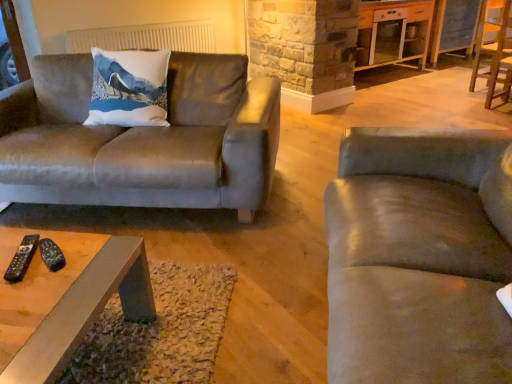
The width and height of the screenshot is (512, 384). Describe the element at coordinates (51, 255) in the screenshot. I see `black plastic remote at lower left, which is the first remote from right to left` at that location.

I want to click on suede couch at left, which appears as the 1th studio couch when viewed from the left, so click(142, 139).

What do you see at coordinates (142, 139) in the screenshot? I see `suede couch at left, which appears as the 2th studio couch when viewed from the right` at bounding box center [142, 139].

Locate an element on the screen. This screenshot has width=512, height=384. white fabric radiator at upper center is located at coordinates (147, 37).

What is the approximate width of white fabric radiator at upper center?

The width of white fabric radiator at upper center is 12.41 centimeters.

Image resolution: width=512 pixels, height=384 pixels. Describe the element at coordinates (494, 39) in the screenshot. I see `wooden chair at right` at that location.

Consider the image. Measure the distance between metallic gray coffee table at center and camera.

metallic gray coffee table at center is 29.10 inches away from camera.

Describe the element at coordinates (420, 257) in the screenshot. This screenshot has height=384, width=512. I see `suede-like gray couch at right, placed as the 2th studio couch when sorted from back to front` at that location.

What is the approximate height of white glossy cabinet at upper right?

white glossy cabinet at upper right is 37.19 inches in height.

I want to click on black plastic remote at lower left, positioned as the second remote in right-to-left order, so click(22, 258).

Image resolution: width=512 pixels, height=384 pixels. What do you see at coordinates (22, 258) in the screenshot?
I see `black plastic remote at lower left, the first remote when ordered from left to right` at bounding box center [22, 258].

I want to click on black plastic remote at lower left, which is the first remote from right to left, so [x=51, y=255].

From a real-world perspective, which object stands above the other?

In real-world perspective, black plastic remote at lower left, which is the first remote from right to left, is above.

Based on the photo, is the depth of black plastic remote at lower left, placed as the second remote when sorted from left to right, less than that of black plastic remote at lower left, the first remote when ordered from left to right?

No.

Who is bigger, black plastic remote at lower left, which is the first remote from right to left, or black plastic remote at lower left, the first remote when ordered from left to right?

With larger size is black plastic remote at lower left, which is the first remote from right to left.

Is black plastic remote at lower left, which is the first remote from right to left, to the left or to the right of black plastic remote at lower left, positioned as the second remote in right-to-left order, in the image?

Based on their positions, black plastic remote at lower left, which is the first remote from right to left, is located to the right of black plastic remote at lower left, positioned as the second remote in right-to-left order.

Would you say metallic gray coffee table at center is outside white fabric radiator at upper center?

Indeed, metallic gray coffee table at center is completely outside white fabric radiator at upper center.

Who is shorter, metallic gray coffee table at center or white fabric radiator at upper center?

metallic gray coffee table at center.

From the image's perspective, is metallic gray coffee table at center above or below white fabric radiator at upper center?

Clearly, from the image's perspective, metallic gray coffee table at center is below white fabric radiator at upper center.

Locate an element on the screen. entertainment center that appears on the right of suede couch at left, which appears as the 1th studio couch when viewed from the left is located at coordinates click(394, 33).

Can you confirm if white glossy cabinet at upper right is positioned to the right of suede couch at left, the 1th studio couch viewed from the back?

Yes.

Considering the positions of objects white glossy cabinet at upper right and suede couch at left, which appears as the 2th studio couch when viewed from the right, in the image provided, who is in front, white glossy cabinet at upper right or suede couch at left, which appears as the 2th studio couch when viewed from the right,?

suede couch at left, which appears as the 2th studio couch when viewed from the right.

Choose the correct answer: Is white glossy cabinet at upper right inside suede couch at left, which appears as the 2th studio couch when viewed from the right, or outside it?

white glossy cabinet at upper right exists outside the volume of suede couch at left, which appears as the 2th studio couch when viewed from the right.

In the scene shown: Considering the relative positions of metallic gray coffee table at center and black plastic remote at lower left, positioned as the second remote in right-to-left order, in the image provided, is metallic gray coffee table at center to the left of black plastic remote at lower left, positioned as the second remote in right-to-left order, from the viewer's perspective?

In fact, metallic gray coffee table at center is to the right of black plastic remote at lower left, positioned as the second remote in right-to-left order.

Considering the positions of points (49, 349) and (34, 236), is point (49, 349) closer to camera compared to point (34, 236)?

Yes, point (49, 349) is in front of point (34, 236).

From the picture: Are metallic gray coffee table at center and black plastic remote at lower left, the first remote when ordered from left to right, beside each other?

metallic gray coffee table at center is not next to black plastic remote at lower left, the first remote when ordered from left to right, and they're not touching.

Looking at this image, is metallic gray coffee table at center taller or shorter than black plastic remote at lower left, positioned as the second remote in right-to-left order?

metallic gray coffee table at center is taller than black plastic remote at lower left, positioned as the second remote in right-to-left order.

Is suede couch at left, the 1th studio couch viewed from the back, to the left or to the right of black plastic remote at lower left, which is the first remote from right to left, in the image?

In the image, suede couch at left, the 1th studio couch viewed from the back, appears on the left side of black plastic remote at lower left, which is the first remote from right to left.

Is suede couch at left, the 1th studio couch viewed from the back, positioned with its back to black plastic remote at lower left, which is the first remote from right to left?

No, suede couch at left, the 1th studio couch viewed from the back,'s orientation is not away from black plastic remote at lower left, which is the first remote from right to left.

From the image's perspective, which object appears higher, suede couch at left, the 1th studio couch viewed from the back, or black plastic remote at lower left, which is the first remote from right to left?

suede couch at left, the 1th studio couch viewed from the back.

Which is in front, suede couch at left, which appears as the 2th studio couch when viewed from the right, or black plastic remote at lower left, placed as the second remote when sorted from left to right?

black plastic remote at lower left, placed as the second remote when sorted from left to right.

Is there a large distance between white fabric radiator at upper center and wooden chair at right?

white fabric radiator at upper center is far away from wooden chair at right.

From the image's perspective, would you say white fabric radiator at upper center is shown under wooden chair at right?

Yes, from the image's perspective, white fabric radiator at upper center is beneath wooden chair at right.

Does white fabric radiator at upper center turn towards wooden chair at right?

No, white fabric radiator at upper center does not turn towards wooden chair at right.

Is white fabric radiator at upper center wider or thinner than wooden chair at right?

white fabric radiator at upper center is thinner than wooden chair at right.

Looking at this image, is wooden chair at right in contact with black plastic remote at lower left, positioned as the second remote in right-to-left order?

They are not placed beside each other.

Considering the relative sizes of wooden chair at right and black plastic remote at lower left, the first remote when ordered from left to right, in the image provided, is wooden chair at right shorter than black plastic remote at lower left, the first remote when ordered from left to right,?

Incorrect, the height of wooden chair at right does not fall short of that of black plastic remote at lower left, the first remote when ordered from left to right.

How far apart are wooden chair at right and black plastic remote at lower left, positioned as the second remote in right-to-left order?

The distance of wooden chair at right from black plastic remote at lower left, positioned as the second remote in right-to-left order, is 4.31 meters.

Would you say wooden chair at right is outside black plastic remote at lower left, the first remote when ordered from left to right?

Absolutely, wooden chair at right is external to black plastic remote at lower left, the first remote when ordered from left to right.

Identify the location of remote above the black plastic remote at lower left, positioned as the second remote in right-to-left order (from the image's perspective). (51, 255).

I want to click on coffee table located below the white fabric radiator at upper center (from the image's perspective), so click(x=66, y=299).

Looking at the image, which one is located closer to black plastic remote at lower left, the first remote when ordered from left to right, metallic gray coffee table at center or black plastic remote at lower left, which is the first remote from right to left?

black plastic remote at lower left, which is the first remote from right to left, is positioned closer to the anchor black plastic remote at lower left, the first remote when ordered from left to right.

Looking at this image, when comparing their distances from white glossy cabinet at upper right, does suede couch at left, which appears as the 2th studio couch when viewed from the right, or white fabric radiator at upper center seem further?

suede couch at left, which appears as the 2th studio couch when viewed from the right, lies further to white glossy cabinet at upper right than the other object.

When comparing their distances from metallic gray coffee table at center, does suede-like gray couch at right, which appears as the 1th studio couch when viewed from the front, or white fabric radiator at upper center seem closer?

suede-like gray couch at right, which appears as the 1th studio couch when viewed from the front, lies closer to metallic gray coffee table at center than the other object.

When comparing their distances from suede-like gray couch at right, placed as the 2th studio couch when sorted from back to front, does suede couch at left, which appears as the 1th studio couch when viewed from the left, or wooden chair at right seem closer?

The object closer to suede-like gray couch at right, placed as the 2th studio couch when sorted from back to front, is suede couch at left, which appears as the 1th studio couch when viewed from the left.

From the image, which object appears to be nearer to white glossy cabinet at upper right, black plastic remote at lower left, placed as the second remote when sorted from left to right, or wooden chair at right?

The object closer to white glossy cabinet at upper right is wooden chair at right.

Based on their spatial positions, is white glossy cabinet at upper right or metallic gray coffee table at center closer to suede-like gray couch at right, placed as the 2th studio couch when sorted from back to front?

metallic gray coffee table at center is positioned closer to the anchor suede-like gray couch at right, placed as the 2th studio couch when sorted from back to front.

Considering their positions, is suede couch at left, which appears as the 1th studio couch when viewed from the left, positioned closer to black plastic remote at lower left, the first remote when ordered from left to right, than black plastic remote at lower left, placed as the second remote when sorted from left to right?

black plastic remote at lower left, placed as the second remote when sorted from left to right.

From the image, which object appears to be nearer to white glossy cabinet at upper right, white fabric radiator at upper center or black plastic remote at lower left, placed as the second remote when sorted from left to right?

white fabric radiator at upper center.

The width and height of the screenshot is (512, 384). What are the coordinates of `chair located between black plastic remote at lower left, placed as the second remote when sorted from left to right, and white glossy cabinet at upper right in the depth direction` in the screenshot? It's located at [494, 39].

Locate an element on the screen. This screenshot has width=512, height=384. remote between black plastic remote at lower left, positioned as the second remote in right-to-left order, and suede-like gray couch at right, placed as the 2th studio couch when sorted from back to front is located at coordinates (51, 255).

This screenshot has height=384, width=512. Identify the location of coffee table between black plastic remote at lower left, the first remote when ordered from left to right, and white glossy cabinet at upper right in the front-back direction. (66, 299).

The width and height of the screenshot is (512, 384). In order to click on studio couch between suede-like gray couch at right, which is counted as the 2th studio couch, starting from the left, and white fabric radiator at upper center in the front-back direction in this screenshot , I will do (x=142, y=139).